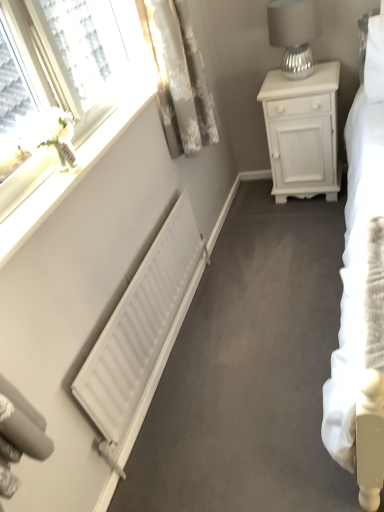
You are a GUI agent. You are given a task and a screenshot of the screen. Output one action in this format:
    pyautogui.click(x=<x>, y=<y>)
    Task: Click on the vacant area situated below silver textured lampshade at upper right (from a real-world perspective)
    This screenshot has width=384, height=512.
    Given the screenshot: What is the action you would take?
    pyautogui.click(x=298, y=78)